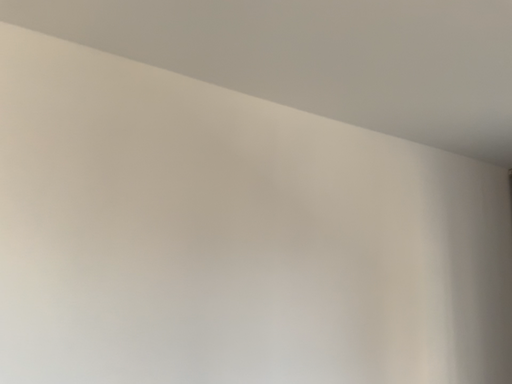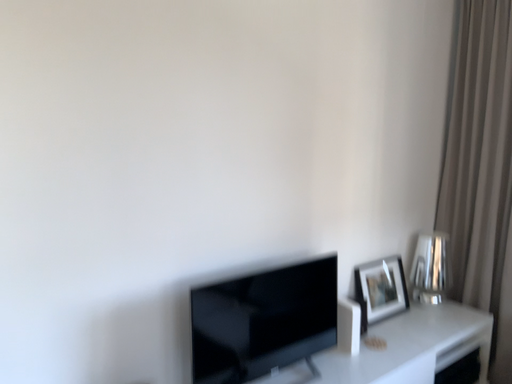
Question: Which way did the camera rotate in the video?

Choices:
 (A) rotated downward
 (B) rotated upward

Answer: (A)